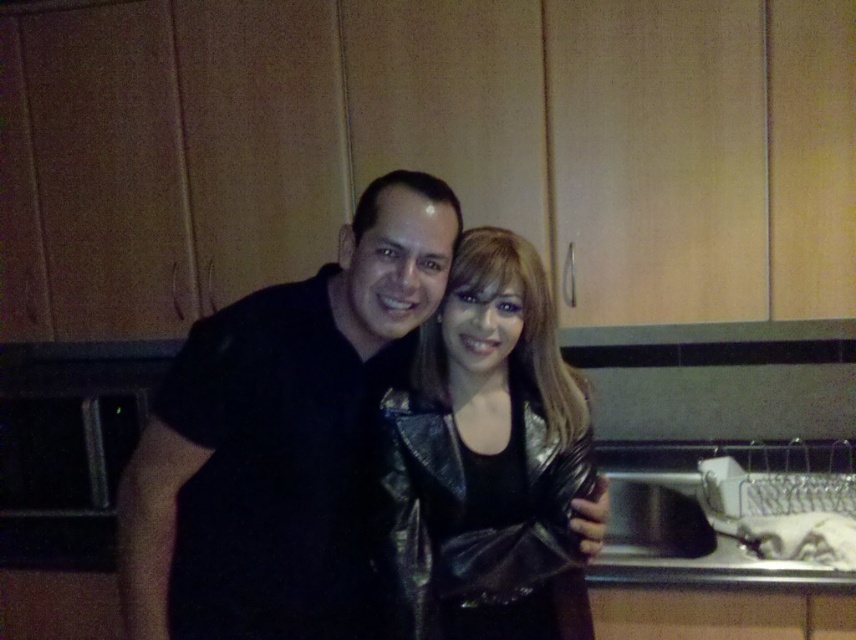
Question: Does black leather jacket at center appear under shiny metallic jacket at center?

Choices:
 (A) no
 (B) yes

Answer: (A)

Question: Among these objects, which one is farthest from the camera?

Choices:
 (A) black leather jacket at center
 (B) shiny metallic jacket at center

Answer: (B)

Question: Does black leather jacket at center have a smaller size compared to shiny metallic jacket at center?

Choices:
 (A) no
 (B) yes

Answer: (A)

Question: Among these points, which one is nearest to the camera?

Choices:
 (A) (173, 490)
 (B) (506, 310)

Answer: (A)

Question: In this image, where is black leather jacket at center located relative to shiny metallic jacket at center?

Choices:
 (A) below
 (B) above

Answer: (B)